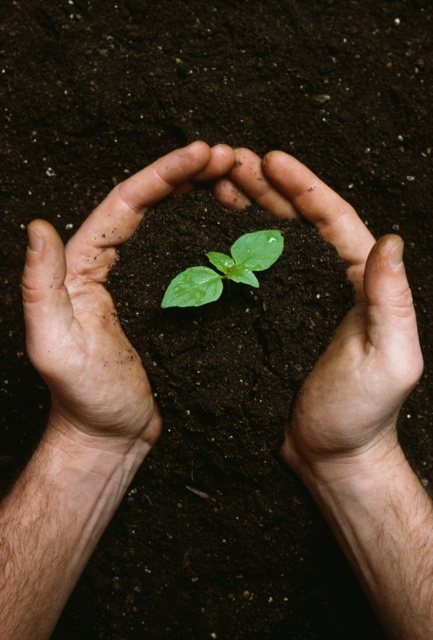
In the scene shown: You are a gardener who wants to water the green glossy leaf at center without getting water on the smooth skin hands at center. The watering can has a narrow spout. Can you water the leaf from this distance?

The smooth skin hands at center and green glossy leaf at center are 3.96 inches apart. Since the watering can has a narrow spout, you can carefully direct the water to the green glossy leaf at center without splashing the smooth skin hands at center from this distance.

You are a photographer aiming to capture a closeup of the plant in the smooth skin hands at center. Given that your camera requires the subject to be within 18 inches for optimal focus, will you need to adjust your position?

The smooth skin hands at center are 22.21 inches away from the camera, which is beyond the 18 inches required for optimal focus. Therefore, you need to move closer to the smooth skin hands at center to achieve the best focus.